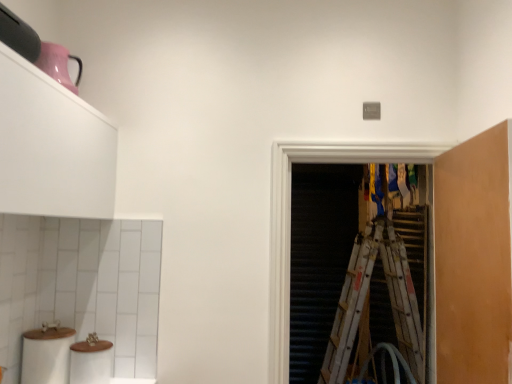
The height and width of the screenshot is (384, 512). What do you see at coordinates (375, 307) in the screenshot?
I see `wooden ladder at right` at bounding box center [375, 307].

You are a GUI agent. You are given a task and a screenshot of the screen. Output one action in this format:
    pyautogui.click(x=<x>, y=<y>)
    Task: Click on the matte orange cabinet at right, positioned as the first cabinetry in right-to-left order
    The width and height of the screenshot is (512, 384).
    Given the screenshot: What is the action you would take?
    pyautogui.click(x=474, y=259)

Image resolution: width=512 pixels, height=384 pixels. Describe the element at coordinates (474, 259) in the screenshot. I see `matte orange cabinet at right, which is the second cabinetry from left to right` at that location.

Identify the location of transparent plastic screen door at center. The image size is (512, 384). (290, 218).

Can you confirm if wooden ladder at right is thinner than matte orange cabinet at right, which is the second cabinetry from left to right?

Indeed, wooden ladder at right has a lesser width compared to matte orange cabinet at right, which is the second cabinetry from left to right.

Considering the sizes of objects wooden ladder at right and matte orange cabinet at right, which is the second cabinetry from left to right, in the image provided, who is smaller, wooden ladder at right or matte orange cabinet at right, which is the second cabinetry from left to right,?

matte orange cabinet at right, which is the second cabinetry from left to right, is smaller.

Relative to matte orange cabinet at right, which is the second cabinetry from left to right, is wooden ladder at right in front or behind?

Visually, wooden ladder at right is located behind matte orange cabinet at right, which is the second cabinetry from left to right.

From the image's perspective, which one is positioned lower, wooden ladder at right or matte orange cabinet at right, positioned as the first cabinetry in right-to-left order?

wooden ladder at right appears lower in the image.

Locate an element on the screen. Image resolution: width=512 pixels, height=384 pixels. cabinetry that is the 1st one when counting upward from the wooden ladder at right (from the image's perspective) is located at coordinates (474, 259).

In terms of height, does matte orange cabinet at right, which is the second cabinetry from left to right, look taller or shorter compared to wooden ladder at right?

In the image, matte orange cabinet at right, which is the second cabinetry from left to right, appears to be shorter than wooden ladder at right.

From the image's perspective, which is above, matte orange cabinet at right, which is the second cabinetry from left to right, or wooden ladder at right?

matte orange cabinet at right, which is the second cabinetry from left to right, is shown above in the image.

How much distance is there between matte orange cabinet at right, which is the second cabinetry from left to right, and wooden ladder at right?

The distance of matte orange cabinet at right, which is the second cabinetry from left to right, from wooden ladder at right is 36.68 inches.

Where is `screen door to the right of white matte cabinet at upper left, arranged as the 2th cabinetry when viewed from the right`? screen door to the right of white matte cabinet at upper left, arranged as the 2th cabinetry when viewed from the right is located at coordinates (290, 218).

From the image's perspective, is transparent plastic screen door at center over white matte cabinet at upper left, arranged as the 2th cabinetry when viewed from the right?

No, from the image's perspective, transparent plastic screen door at center is not on top of white matte cabinet at upper left, arranged as the 2th cabinetry when viewed from the right.

Is transparent plastic screen door at center not within white matte cabinet at upper left, arranged as the 2th cabinetry when viewed from the right?

Absolutely, transparent plastic screen door at center is external to white matte cabinet at upper left, arranged as the 2th cabinetry when viewed from the right.

Can you confirm if transparent plastic screen door at center is thinner than white matte cabinet at upper left, which is the first cabinetry in left-to-right order?

Yes, transparent plastic screen door at center is thinner than white matte cabinet at upper left, which is the first cabinetry in left-to-right order.

From the image's perspective, which is below, white matte toilet paper at lower left or matte orange cabinet at right, which is the second cabinetry from left to right?

white matte toilet paper at lower left is shown below in the image.

The height and width of the screenshot is (384, 512). Find the location of `toilet paper below the matte orange cabinet at right, positioned as the first cabinetry in right-to-left order (from the image's perspective)`. toilet paper below the matte orange cabinet at right, positioned as the first cabinetry in right-to-left order (from the image's perspective) is located at coordinates (46, 355).

Is white matte toilet paper at lower left taller or shorter than matte orange cabinet at right, which is the second cabinetry from left to right?

Considering their sizes, white matte toilet paper at lower left has less height than matte orange cabinet at right, which is the second cabinetry from left to right.

Considering the sizes of objects white matte toilet paper at lower left and matte orange cabinet at right, which is the second cabinetry from left to right, in the image provided, who is smaller, white matte toilet paper at lower left or matte orange cabinet at right, which is the second cabinetry from left to right,?

With smaller size is white matte toilet paper at lower left.

Visually, is white matte toilet paper at lower left positioned to the left or to the right of white matte cabinet at upper left, arranged as the 2th cabinetry when viewed from the right?

Clearly, white matte toilet paper at lower left is on the left of white matte cabinet at upper left, arranged as the 2th cabinetry when viewed from the right, in the image.

Considering the sizes of white matte toilet paper at lower left and white matte cabinet at upper left, arranged as the 2th cabinetry when viewed from the right, in the image, is white matte toilet paper at lower left taller or shorter than white matte cabinet at upper left, arranged as the 2th cabinetry when viewed from the right,?

white matte toilet paper at lower left is shorter than white matte cabinet at upper left, arranged as the 2th cabinetry when viewed from the right.

Is the depth of white matte toilet paper at lower left greater than that of white matte cabinet at upper left, which is the first cabinetry in left-to-right order?

That is True.

Is white matte cabinet at upper left, arranged as the 2th cabinetry when viewed from the right, inside white matte toilet paper at lower left?

That's incorrect, white matte cabinet at upper left, arranged as the 2th cabinetry when viewed from the right, is not inside white matte toilet paper at lower left.

Could wooden ladder at right be considered to be inside white matte toilet paper at lower left?

Definitely not — wooden ladder at right is not inside white matte toilet paper at lower left.

Identify the location of toilet paper above the wooden ladder at right (from the image's perspective). This screenshot has width=512, height=384. (46, 355).

From the image's perspective, is white matte toilet paper at lower left located beneath wooden ladder at right?

Actually, white matte toilet paper at lower left appears above wooden ladder at right in the image.

Is white matte toilet paper at lower left to the left or to the right of wooden ladder at right in the image?

In the image, white matte toilet paper at lower left appears on the left side of wooden ladder at right.

Consider the image. Is wooden ladder at right a part of transparent plastic screen door at center?

Actually, wooden ladder at right is outside transparent plastic screen door at center.

Is transparent plastic screen door at center positioned with its back to wooden ladder at right?

Absolutely, transparent plastic screen door at center is directed away from wooden ladder at right.

Looking at this image, based on their positions, is transparent plastic screen door at center located to the left or right of wooden ladder at right?

Based on their positions, transparent plastic screen door at center is located to the left of wooden ladder at right.

Does transparent plastic screen door at center have a greater width compared to wooden ladder at right?

Indeed, transparent plastic screen door at center has a greater width compared to wooden ladder at right.

I want to click on ladder that appears below the matte orange cabinet at right, which is the second cabinetry from left to right (from a real-world perspective), so click(375, 307).

Identify the location of ladder on the right of the matte orange cabinet at right, positioned as the first cabinetry in right-to-left order. (375, 307).

Based on their spatial positions, is wooden ladder at right or transparent plastic screen door at center further from white matte cabinet at upper left, arranged as the 2th cabinetry when viewed from the right?

The object further to white matte cabinet at upper left, arranged as the 2th cabinetry when viewed from the right, is wooden ladder at right.

Based on their spatial positions, is white matte toilet paper at lower left or transparent plastic screen door at center closer to white matte cabinet at upper left, which is the first cabinetry in left-to-right order?

white matte toilet paper at lower left.

Based on their spatial positions, is wooden ladder at right or white matte toilet paper at lower left further from white matte cabinet at upper left, arranged as the 2th cabinetry when viewed from the right?

wooden ladder at right is further to white matte cabinet at upper left, arranged as the 2th cabinetry when viewed from the right.

From the image, which object appears to be farther from white matte toilet paper at lower left, white matte cabinet at upper left, which is the first cabinetry in left-to-right order, or transparent plastic screen door at center?

The object further to white matte toilet paper at lower left is transparent plastic screen door at center.

From the image, which object appears to be farther from wooden ladder at right, transparent plastic screen door at center or white matte toilet paper at lower left?

white matte toilet paper at lower left is positioned further to the anchor wooden ladder at right.

Considering their positions, is white matte cabinet at upper left, which is the first cabinetry in left-to-right order, positioned further to wooden ladder at right than white matte toilet paper at lower left?

Among the two, white matte toilet paper at lower left is located further to wooden ladder at right.

Estimate the real-world distances between objects in this image. Which object is closer to transparent plastic screen door at center, matte orange cabinet at right, positioned as the first cabinetry in right-to-left order, or white matte toilet paper at lower left?

matte orange cabinet at right, positioned as the first cabinetry in right-to-left order, is closer to transparent plastic screen door at center.

Based on their spatial positions, is wooden ladder at right or matte orange cabinet at right, positioned as the first cabinetry in right-to-left order, further from white matte cabinet at upper left, arranged as the 2th cabinetry when viewed from the right?

The object further to white matte cabinet at upper left, arranged as the 2th cabinetry when viewed from the right, is wooden ladder at right.

The height and width of the screenshot is (384, 512). Find the location of `cabinetry between white matte toilet paper at lower left and matte orange cabinet at right, which is the second cabinetry from left to right, in the horizontal direction`. cabinetry between white matte toilet paper at lower left and matte orange cabinet at right, which is the second cabinetry from left to right, in the horizontal direction is located at coordinates pos(52,147).

Where is `screen door between white matte cabinet at upper left, which is the first cabinetry in left-to-right order, and wooden ladder at right`? screen door between white matte cabinet at upper left, which is the first cabinetry in left-to-right order, and wooden ladder at right is located at coordinates (290, 218).

Locate an element on the screen. screen door between white matte cabinet at upper left, arranged as the 2th cabinetry when viewed from the right, and matte orange cabinet at right, which is the second cabinetry from left to right is located at coordinates (290, 218).

Find the location of a particular element. This screenshot has width=512, height=384. screen door between matte orange cabinet at right, which is the second cabinetry from left to right, and wooden ladder at right in the front-back direction is located at coordinates (290, 218).